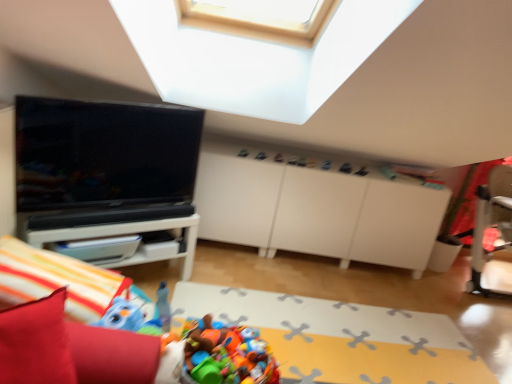
In order to face matte black tv at left, should I rotate leftwards or rightwards?

To align with it, rotate left about 18.148°.

The image size is (512, 384). What do you see at coordinates (345, 168) in the screenshot?
I see `matte black toy at upper center, the 3th toy when ordered from left to right` at bounding box center [345, 168].

Describe the element at coordinates (316, 212) in the screenshot. This screenshot has width=512, height=384. I see `white matte dresser at center` at that location.

Image resolution: width=512 pixels, height=384 pixels. Describe the element at coordinates (340, 337) in the screenshot. I see `plastic toy basket at lower center` at that location.

Locate an element on the screen. The width and height of the screenshot is (512, 384). plastic colorful toys at lower center, marked as the 1th toy in a left-to-right arrangement is located at coordinates (228, 355).

Is point (224, 176) closer or farther from the camera than point (120, 232)?

Point (224, 176) is farther from the camera than point (120, 232).

Relative to white glossy table at left, is white matte dresser at center in front or behind?

Clearly, white matte dresser at center is behind white glossy table at left.

Between white matte dresser at center and white glossy table at left, which one appears on the right side from the viewer's perspective?

Positioned to the right is white matte dresser at center.

Is matte black tv at left far from white glossy table at left?

No, matte black tv at left is in close proximity to white glossy table at left.

Which is more to the right, matte black tv at left or white glossy table at left?

matte black tv at left is more to the right.

From the image's perspective, does matte black tv at left appear higher than white glossy table at left?

Yes, from the image's perspective, matte black tv at left is on top of white glossy table at left.

Is matte black tv at left oriented away from white glossy table at left?

No, matte black tv at left is not facing away from white glossy table at left.

Looking at this image, looking at their sizes, would you say plastic colorful toys at lower center, which is counted as the first toy, starting from the bottom, is wider or thinner than white matte dresser at center?

Clearly, plastic colorful toys at lower center, which is counted as the first toy, starting from the bottom, has less width compared to white matte dresser at center.

Is plastic colorful toys at lower center, marked as the 1th toy in a left-to-right arrangement, shorter than white matte dresser at center?

Correct, plastic colorful toys at lower center, marked as the 1th toy in a left-to-right arrangement, is not as tall as white matte dresser at center.

From the picture: Between plastic colorful toys at lower center, which is counted as the first toy, starting from the bottom, and white matte dresser at center, which one appears on the left side from the viewer's perspective?

plastic colorful toys at lower center, which is counted as the first toy, starting from the bottom.

Could you tell me if plastic colorful toys at lower center, the 3th toy when ordered from back to front, is facing white matte dresser at center?

No, plastic colorful toys at lower center, the 3th toy when ordered from back to front, does not turn towards white matte dresser at center.

Consider the image. Is matte black tv at left next to matte plastic toy at upper center, placed as the 2th toy when sorted from right to left?

No, matte black tv at left is not next to matte plastic toy at upper center, placed as the 2th toy when sorted from right to left.

Considering the relative positions of matte black tv at left and matte plastic toy at upper center, which ranks as the second toy in left-to-right order, in the image provided, is matte black tv at left behind matte plastic toy at upper center, which ranks as the second toy in left-to-right order,?

That is False.

Can you confirm if matte black tv at left is positioned to the right of matte plastic toy at upper center, the 1th toy in the top-to-bottom sequence?

In fact, matte black tv at left is to the left of matte plastic toy at upper center, the 1th toy in the top-to-bottom sequence.

Considering the sizes of objects matte black toy at upper center, the first toy positioned from the back, and matte plastic toy at upper center, which ranks as the second toy in left-to-right order, in the image provided, who is shorter, matte black toy at upper center, the first toy positioned from the back, or matte plastic toy at upper center, which ranks as the second toy in left-to-right order,?

matte plastic toy at upper center, which ranks as the second toy in left-to-right order.

Based on the photo, from a real-world perspective, which is physically above, matte black toy at upper center, the first toy positioned from the back, or matte plastic toy at upper center, which is the second toy in back-to-front order?

matte plastic toy at upper center, which is the second toy in back-to-front order, from a real-world perspective.

Who is bigger, matte black toy at upper center, the second toy in the bottom-to-top sequence, or matte plastic toy at upper center, which ranks as the second toy in left-to-right order?

With larger size is matte black toy at upper center, the second toy in the bottom-to-top sequence.

Considering the sizes of white glossy table at left and plastic colorful toys at lower center, the third toy when ordered from top to bottom, in the image, is white glossy table at left taller or shorter than plastic colorful toys at lower center, the third toy when ordered from top to bottom,?

In the image, white glossy table at left appears to be taller than plastic colorful toys at lower center, the third toy when ordered from top to bottom.

Looking at this image, could you tell me if white glossy table at left is facing plastic colorful toys at lower center, which is counted as the first toy, starting from the bottom?

Yes, white glossy table at left is turned towards plastic colorful toys at lower center, which is counted as the first toy, starting from the bottom.

Measure the distance between white glossy table at left and plastic colorful toys at lower center, the third toy when ordered from top to bottom.

35.70 inches.

At what (x,y) coordinates should I click in order to perform the action: click on toy that appears below the white glossy table at left (from a real-world perspective). Please return your answer as a coordinate pair (x, y). The width and height of the screenshot is (512, 384). Looking at the image, I should click on (228, 355).

From a real-world perspective, who is located higher, plastic colorful toys at lower center, which is counted as the third toy, starting from the right, or matte black toy at upper center, the second toy viewed from the top?

matte black toy at upper center, the second toy viewed from the top.

Considering the relative positions of plastic colorful toys at lower center, marked as the 1th toy in a left-to-right arrangement, and matte black toy at upper center, the second toy viewed from the top, in the image provided, is plastic colorful toys at lower center, marked as the 1th toy in a left-to-right arrangement, to the right of matte black toy at upper center, the second toy viewed from the top, from the viewer's perspective?

No.

Is there a large distance between plastic colorful toys at lower center, the third toy when ordered from top to bottom, and matte black toy at upper center, acting as the 1th toy starting from the right?

plastic colorful toys at lower center, the third toy when ordered from top to bottom, is far away from matte black toy at upper center, acting as the 1th toy starting from the right.

Is point (189, 360) closer or farther from the camera than point (343, 171)?

Point (189, 360) is closer to the camera than point (343, 171).

In the image, there is a white glossy table at left. Identify the location of dresser above it (from the image's perspective). (316, 212).

This screenshot has width=512, height=384. In order to click on television located on the right of white glossy table at left in this screenshot , I will do `click(103, 153)`.

Based on the photo, from the image, which object appears to be farther from matte black tv at left, red fabric bean bag chair at lower left or matte plastic toy at upper center, placed as the 2th toy when sorted from right to left?

Among the two, red fabric bean bag chair at lower left is located further to matte black tv at left.

From the image, which object appears to be nearer to plastic colorful toys at lower center, marked as the 1th toy in a left-to-right arrangement, matte black tv at left or white glossy table at left?

white glossy table at left.

Based on their spatial positions, is white matte dresser at center or matte black toy at upper center, acting as the 1th toy starting from the right, closer to white glossy table at left?

white matte dresser at center lies closer to white glossy table at left than the other object.

Based on their spatial positions, is matte black toy at upper center, the second toy in the bottom-to-top sequence, or matte plastic toy at upper center, the 1th toy in the top-to-bottom sequence, further from white matte dresser at center?

Among the two, matte plastic toy at upper center, the 1th toy in the top-to-bottom sequence, is located further to white matte dresser at center.

When comparing their distances from matte plastic toy at upper center, which is the second toy in back-to-front order, does white matte dresser at center or plastic toy basket at lower center seem closer?

white matte dresser at center is positioned closer to the anchor matte plastic toy at upper center, which is the second toy in back-to-front order.

From the image, which object appears to be nearer to matte plastic toy at upper center, the 1th toy in the top-to-bottom sequence, white matte dresser at center or plastic colorful toys at lower center, the 3th toy when ordered from back to front?

white matte dresser at center.

Looking at the image, which one is located further to matte black toy at upper center, the second toy in the bottom-to-top sequence, white glossy table at left or plastic toy basket at lower center?

white glossy table at left.

Which object lies further to the anchor point red fabric bean bag chair at lower left, plastic colorful toys at lower center, the third toy when ordered from top to bottom, or matte black toy at upper center, the second toy viewed from the top?

matte black toy at upper center, the second toy viewed from the top, is positioned further to the anchor red fabric bean bag chair at lower left.

Image resolution: width=512 pixels, height=384 pixels. Find the location of `television positioned between red fabric bean bag chair at lower left and white glossy table at left from near to far`. television positioned between red fabric bean bag chair at lower left and white glossy table at left from near to far is located at coordinates (103, 153).

Locate an element on the screen. The width and height of the screenshot is (512, 384). toy positioned between red fabric bean bag chair at lower left and matte black tv at left from near to far is located at coordinates (228, 355).

The height and width of the screenshot is (384, 512). What are the coordinates of `toy positioned between red fabric bean bag chair at lower left and matte plastic toy at upper center, placed as the 2th toy when sorted from right to left, from near to far` in the screenshot? It's located at (228, 355).

Image resolution: width=512 pixels, height=384 pixels. Find the location of `plain between plastic colorful toys at lower center, marked as the 1th toy in a left-to-right arrangement, and matte black toy at upper center, the first toy positioned from the back, in the front-back direction`. plain between plastic colorful toys at lower center, marked as the 1th toy in a left-to-right arrangement, and matte black toy at upper center, the first toy positioned from the back, in the front-back direction is located at coordinates (340, 337).